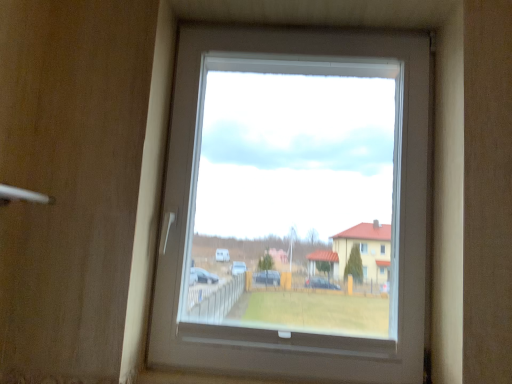
Where is `transparent glass window at center`? This screenshot has width=512, height=384. transparent glass window at center is located at coordinates (295, 206).

Describe the element at coordinates (295, 206) in the screenshot. I see `transparent glass window at center` at that location.

This screenshot has width=512, height=384. I want to click on transparent glass window at center, so click(x=295, y=206).